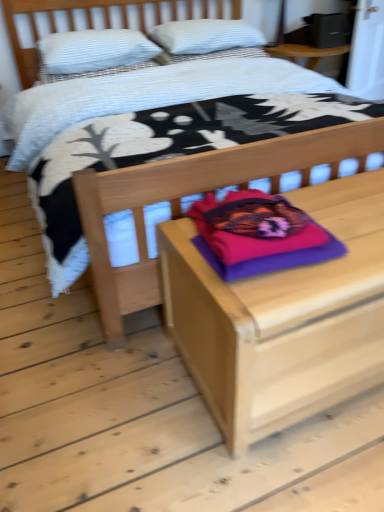
Locate an element on the screen. Image resolution: width=384 pixels, height=512 pixels. free spot to the right of purple soft pillow at center, which ranks as the third pillow in top-to-bottom order is located at coordinates click(346, 217).